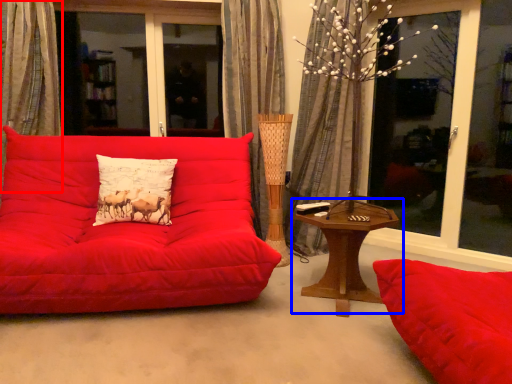
Question: Which of the following is the closest to the observer, curtain (highlighted by a red box) or table (highlighted by a blue box)?

Choices:
 (A) curtain
 (B) table

Answer: (B)